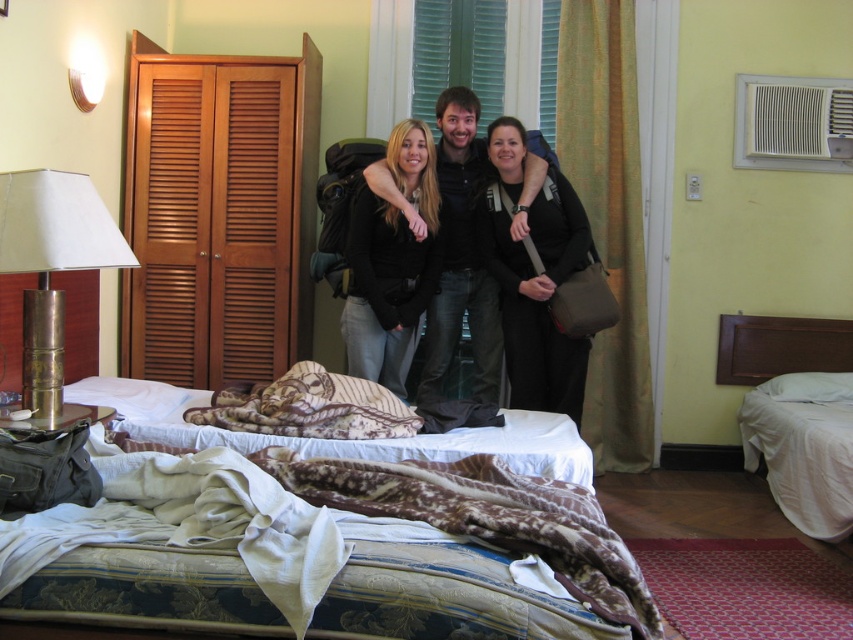
Question: Which of the following is the closest to the observer?

Choices:
 (A) (13, 228)
 (B) (538, 157)
 (C) (821, 323)
 (D) (184, 429)

Answer: (A)

Question: Does brown textured blanket at center appear on the left side of white fabric bed at right?

Choices:
 (A) yes
 (B) no

Answer: (A)

Question: Considering the relative positions of brown textured blanket at center and white fabric bed at right in the image provided, where is brown textured blanket at center located with respect to white fabric bed at right?

Choices:
 (A) right
 (B) left

Answer: (B)

Question: From the image, what is the correct spatial relationship of black fabric backpack at center in relation to matte black backpack at center?

Choices:
 (A) right
 (B) left

Answer: (A)

Question: Which object appears farthest from the camera in this image?

Choices:
 (A) black matte jacket at center
 (B) patterned fabric bed at center

Answer: (A)

Question: Which of these objects is positioned closest to the white fabric bed at right?

Choices:
 (A) matte black backpack at center
 (B) black matte jacket at center
 (C) brown textured blanket at center
 (D) brass/textured lamp at left

Answer: (A)